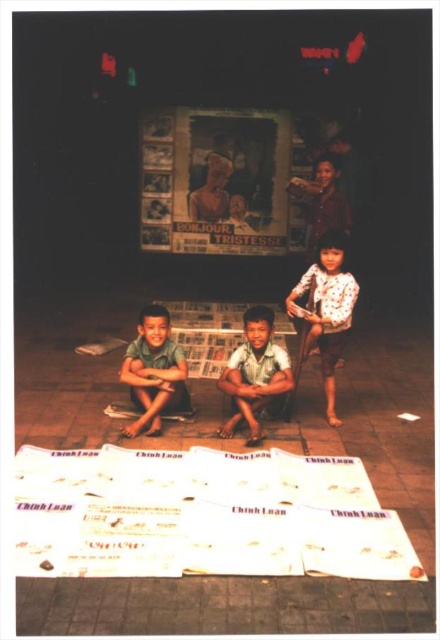
Question: Can you confirm if white cotton shirt at right is smaller than light brown fabric boy at center?

Choices:
 (A) yes
 (B) no

Answer: (B)

Question: Can you confirm if white paper at lower center is positioned to the left of matte paper poster at upper center?

Choices:
 (A) yes
 (B) no

Answer: (B)

Question: Which point appears farthest from the camera in this image?

Choices:
 (A) (209, 196)
 (B) (314, 328)

Answer: (A)

Question: Can you confirm if matte paper poster at upper center is positioned to the right of light brown fabric boy at center?

Choices:
 (A) yes
 (B) no

Answer: (B)

Question: Among these points, which one is farthest from the camera?

Choices:
 (A) (128, 432)
 (B) (260, 387)
 (C) (404, 598)

Answer: (B)

Question: Which point is closer to the camera?

Choices:
 (A) (334, 257)
 (B) (282, 369)
 (C) (127, 380)

Answer: (C)